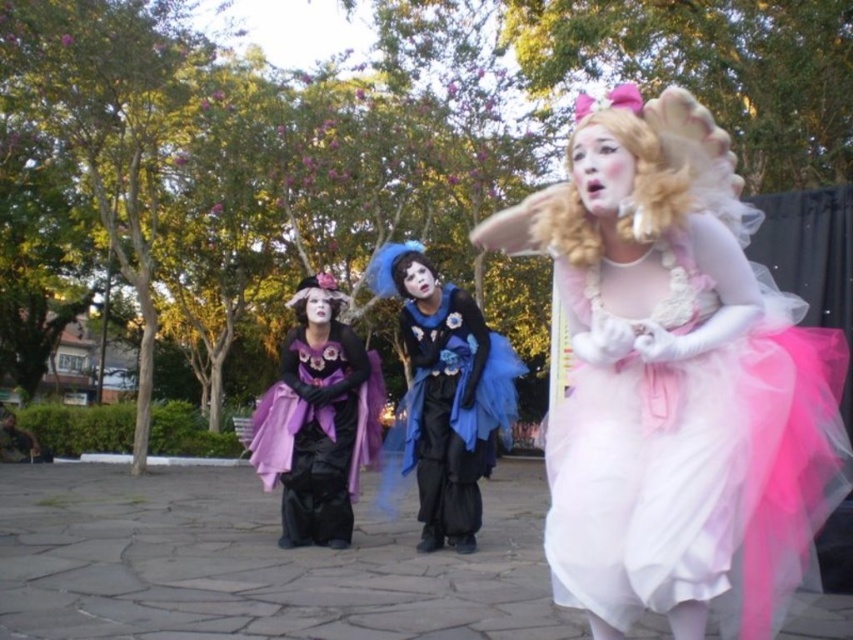
Question: Based on their relative distances, which object is nearer to the matte white dress at center?

Choices:
 (A) matte blue tulle dress at center
 (B) matte purple coat at center
 (C) blue tulle wig at center
 (D) blonde curly wig at center

Answer: (D)

Question: Which is farther from the blonde curly wig at center?

Choices:
 (A) blue tulle wig at center
 (B) matte purple coat at center

Answer: (B)

Question: Considering the relative positions of matte blue tulle dress at center and blue tulle wig at center in the image provided, where is matte blue tulle dress at center located with respect to blue tulle wig at center?

Choices:
 (A) right
 (B) left

Answer: (A)

Question: Can you confirm if matte purple coat at center is positioned below blue tulle wig at center?

Choices:
 (A) no
 (B) yes

Answer: (B)

Question: Among these points, which one is nearest to the camera?

Choices:
 (A) (350, 516)
 (B) (747, 452)

Answer: (B)

Question: Is matte purple coat at center to the right of blonde curly wig at center from the viewer's perspective?

Choices:
 (A) no
 (B) yes

Answer: (A)